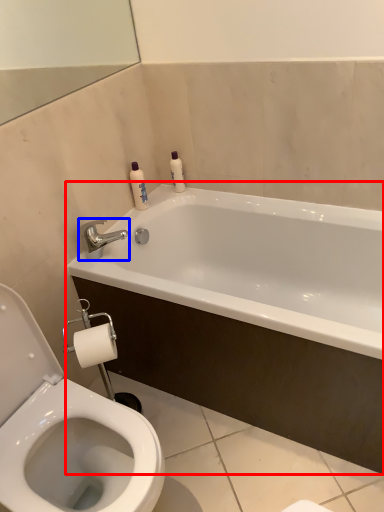
Question: Among these objects, which one is farthest to the camera, bathtub (highlighted by a red box) or tap (highlighted by a blue box)?

Choices:
 (A) bathtub
 (B) tap

Answer: (B)